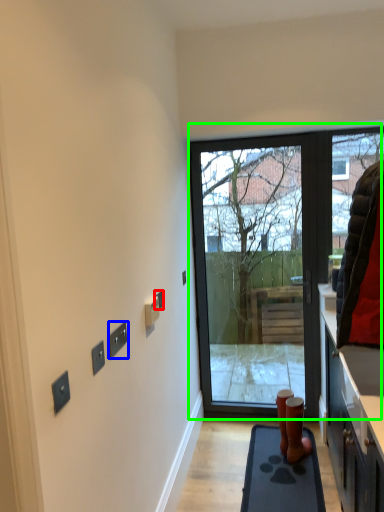
Question: Considering the real-world distances, which object is farthest from electric outlet (highlighted by a red box)? electric outlet (highlighted by a blue box) or door (highlighted by a green box)?

Choices:
 (A) electric outlet
 (B) door

Answer: (B)